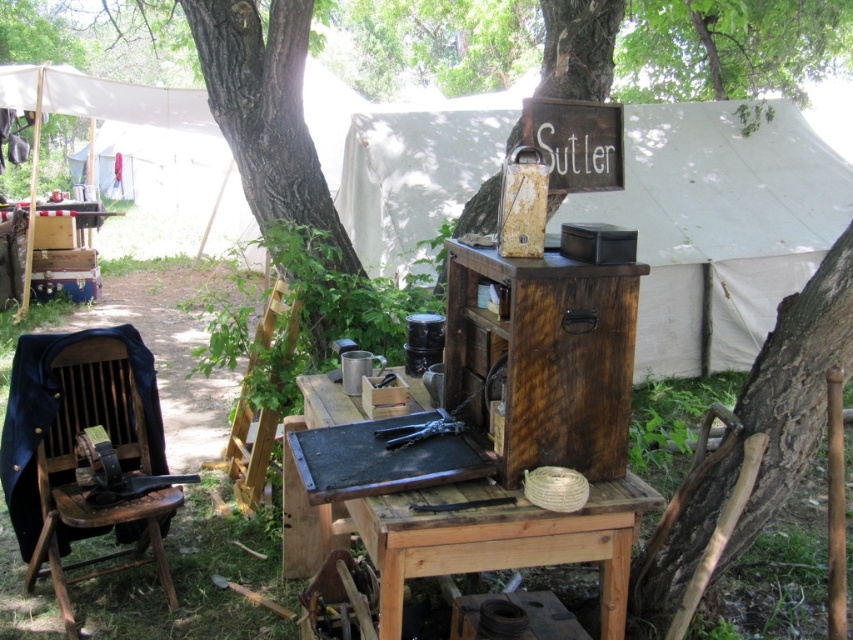
You are standing at the entrance of the sutler tent and want to place an order. Where is the rustic wood picnic table at center located in relation to the tent?

The rustic wood picnic table at center is located at point (473,538) in 2D coordinates relative to the tent entrance.

You are setting up a picnic area and need to place a 3ft wide blanket on the ground. The rustic wood picnic table at center is in the way. Can you move the brown wood chair at left out of the way to make space for the blanket?

The rustic wood picnic table at center might be wider than brown wood chair at left, so moving the brown wood chair at left might not be sufficient to make enough space for the 3ft wide blanket since the table itself could be occupying more width.

You are setting up a historical reenactment campsite and need to place a flagpole in front of the rustic wood picnic table at center. Can you place it in front of the table without moving the wooden crate at center?

The rustic wood picnic table at center is behind the wooden crate at center, so the wooden crate is in front of the table. Therefore, you can place the flagpole in front of the table without moving the wooden crate at center since the crate is already positioned in front.